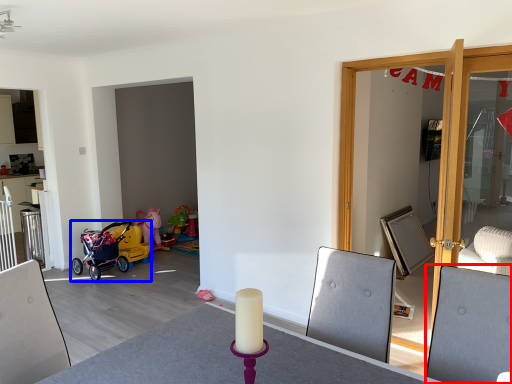
Question: Which of the following is the farthest to the observer, swivel chair (highlighted by a red box) or stroller (highlighted by a blue box)?

Choices:
 (A) swivel chair
 (B) stroller

Answer: (B)